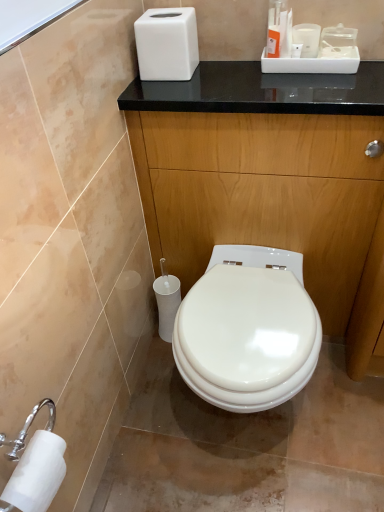
Describe the element at coordinates (37, 473) in the screenshot. I see `white matte toilet paper at lower left, which is the 1th toilet paper in front-to-back order` at that location.

I want to click on white matte toilet paper at lower left, marked as the 1th toilet paper in a bottom-to-top arrangement, so click(x=37, y=473).

Where is `white plastic toilet paper at lower left, which ranks as the second toilet paper in left-to-right order`? This screenshot has width=384, height=512. white plastic toilet paper at lower left, which ranks as the second toilet paper in left-to-right order is located at coordinates (167, 301).

At what (x,y) coordinates should I click in order to perform the action: click on white matte tissue box at upper center. Please return your answer as a coordinate pair (x, y). The image size is (384, 512). Looking at the image, I should click on (167, 44).

What's the angular difference between white plastic toilet paper at lower left, arranged as the 2th toilet paper when viewed from the front, and white matte tissue box at upper center's facing directions?

2.21 degrees separate the facing orientations of white plastic toilet paper at lower left, arranged as the 2th toilet paper when viewed from the front, and white matte tissue box at upper center.

Does white plastic toilet paper at lower left, which is counted as the 2th toilet paper, starting from the bottom, have a greater width compared to white matte tissue box at upper center?

Incorrect, the width of white plastic toilet paper at lower left, which is counted as the 2th toilet paper, starting from the bottom, does not surpass that of white matte tissue box at upper center.

Consider the image. Would you say white plastic toilet paper at lower left, which is counted as the 2th toilet paper, starting from the bottom, contains white matte tissue box at upper center?

No, white matte tissue box at upper center is located outside of white plastic toilet paper at lower left, which is counted as the 2th toilet paper, starting from the bottom.

From the image's perspective, is white plastic toilet paper at lower left, arranged as the 2th toilet paper when viewed from the front, over white matte tissue box at upper center?

No, from the image's perspective, white plastic toilet paper at lower left, arranged as the 2th toilet paper when viewed from the front, is not above white matte tissue box at upper center.

Based on the photo, is white matte toilet paper at lower left, which is the 1th toilet paper in front-to-back order, not within glossy wood dresser at center?

Yes, white matte toilet paper at lower left, which is the 1th toilet paper in front-to-back order, is not within glossy wood dresser at center.

Looking at their sizes, would you say white matte toilet paper at lower left, marked as the 1th toilet paper in a bottom-to-top arrangement, is wider or thinner than glossy wood dresser at center?

Considering their sizes, white matte toilet paper at lower left, marked as the 1th toilet paper in a bottom-to-top arrangement, looks slimmer than glossy wood dresser at center.

Is white matte toilet paper at lower left, marked as the 1th toilet paper in a bottom-to-top arrangement, next to glossy wood dresser at center and touching it?

No, white matte toilet paper at lower left, marked as the 1th toilet paper in a bottom-to-top arrangement, is not making contact with glossy wood dresser at center.

From the image's perspective, is white matte toilet paper at lower left, which is the 1th toilet paper in front-to-back order, located above glossy wood dresser at center?

No, from the image's perspective, white matte toilet paper at lower left, which is the 1th toilet paper in front-to-back order, is not over glossy wood dresser at center.

Where is `dresser lying above the white glossy toilet at center (from the image's perspective)`? dresser lying above the white glossy toilet at center (from the image's perspective) is located at coordinates (270, 181).

From a real-world perspective, is glossy wood dresser at center beneath white glossy toilet at center?

Incorrect, from a real-world perspective, glossy wood dresser at center is higher than white glossy toilet at center.

Is glossy wood dresser at center facing away from white glossy toilet at center?

Yes, glossy wood dresser at center is positioned with its back facing white glossy toilet at center.

Based on the photo, which of these two, glossy wood dresser at center or white glossy toilet at center, stands shorter?

white glossy toilet at center.

From a real-world perspective, is white matte tissue box at upper center physically located above or below white plastic toilet paper at lower left, which is counted as the 2th toilet paper, starting from the bottom?

white matte tissue box at upper center is situated higher than white plastic toilet paper at lower left, which is counted as the 2th toilet paper, starting from the bottom, in the real world.

Is white matte tissue box at upper center positioned with its back to white plastic toilet paper at lower left, marked as the 1th toilet paper in a top-to-bottom arrangement?

white matte tissue box at upper center does not have its back to white plastic toilet paper at lower left, marked as the 1th toilet paper in a top-to-bottom arrangement.

Could you measure the distance between white matte tissue box at upper center and white plastic toilet paper at lower left, which appears as the first toilet paper when viewed from the back?

A distance of 27.76 inches exists between white matte tissue box at upper center and white plastic toilet paper at lower left, which appears as the first toilet paper when viewed from the back.

Is white matte tissue box at upper center further to the viewer compared to white plastic toilet paper at lower left, arranged as the 2th toilet paper when viewed from the front?

No.

From the image's perspective, is glossy wood dresser at center beneath white matte tissue box at upper center?

Yes, from the image's perspective, glossy wood dresser at center is beneath white matte tissue box at upper center.

From a real-world perspective, between glossy wood dresser at center and white matte tissue box at upper center, who is vertically higher?

white matte tissue box at upper center.

Find the location of a particular element. The width and height of the screenshot is (384, 512). dresser below the white matte tissue box at upper center (from the image's perspective) is located at coordinates (270, 181).

Which is behind, point (251, 101) or point (168, 48)?

The point (251, 101) is behind.

Is white matte toilet paper at lower left, marked as the second toilet paper in a top-to-bottom arrangement, at the back of white matte tissue box at upper center?

No.

From the image's perspective, is white matte tissue box at upper center on white matte toilet paper at lower left, the 2th toilet paper viewed from the back?

Yes, from the image's perspective, white matte tissue box at upper center is on top of white matte toilet paper at lower left, the 2th toilet paper viewed from the back.

Does point (149, 11) lie behind point (2, 500)?

That is True.

Can you tell me how much white matte toilet paper at lower left, arranged as the first toilet paper when viewed from the left, and white glossy toilet at center differ in facing direction?

There is a 88.8-degree angle between the facing directions of white matte toilet paper at lower left, arranged as the first toilet paper when viewed from the left, and white glossy toilet at center.

Could you tell me if white matte toilet paper at lower left, which is the 1th toilet paper in front-to-back order, is turned towards white glossy toilet at center?

No, white matte toilet paper at lower left, which is the 1th toilet paper in front-to-back order, is not oriented towards white glossy toilet at center.

Which of these two, white matte toilet paper at lower left, the 2th toilet paper viewed from the back, or white glossy toilet at center, stands taller?

white glossy toilet at center.

The image size is (384, 512). I want to click on hand dryer located on the right of white plastic toilet paper at lower left, arranged as the 2th toilet paper when viewed from the front, so click(x=167, y=44).

There is a glossy wood dresser at center. Where is `the 2nd toilet paper below it (from the image's perspective)`? Image resolution: width=384 pixels, height=512 pixels. the 2nd toilet paper below it (from the image's perspective) is located at coordinates (37, 473).

Based on their spatial positions, is white matte toilet paper at lower left, marked as the 1th toilet paper in a bottom-to-top arrangement, or white glossy toilet at center further from white plastic toilet paper at lower left, arranged as the 2th toilet paper when viewed from the front?

Based on the image, white matte toilet paper at lower left, marked as the 1th toilet paper in a bottom-to-top arrangement, appears to be further to white plastic toilet paper at lower left, arranged as the 2th toilet paper when viewed from the front.

Estimate the real-world distances between objects in this image. Which object is closer to white glossy toilet at center, white matte tissue box at upper center or white matte toilet paper at lower left, marked as the 1th toilet paper in a bottom-to-top arrangement?

white matte toilet paper at lower left, marked as the 1th toilet paper in a bottom-to-top arrangement, lies closer to white glossy toilet at center than the other object.

Which object lies nearer to the anchor point white glossy toilet at center, white matte toilet paper at lower left, the 2th toilet paper viewed from the back, or white matte tissue box at upper center?

Result: white matte toilet paper at lower left, the 2th toilet paper viewed from the back, lies closer to white glossy toilet at center than the other object.

When comparing their distances from white matte tissue box at upper center, does glossy wood dresser at center or white plastic toilet paper at lower left, which ranks as the second toilet paper in left-to-right order, seem closer?

glossy wood dresser at center.

Estimate the real-world distances between objects in this image. Which object is further from white plastic toilet paper at lower left, which is counted as the 2th toilet paper, starting from the bottom, white glossy toilet at center or white matte tissue box at upper center?

white matte tissue box at upper center is further to white plastic toilet paper at lower left, which is counted as the 2th toilet paper, starting from the bottom.

Looking at this image, when comparing their distances from white plastic toilet paper at lower left, which is counted as the 2th toilet paper, starting from the bottom, does glossy wood dresser at center or white glossy toilet at center seem closer?

white glossy toilet at center is positioned closer to the anchor white plastic toilet paper at lower left, which is counted as the 2th toilet paper, starting from the bottom.

Considering their positions, is white glossy toilet at center positioned further to white matte tissue box at upper center than white matte toilet paper at lower left, arranged as the first toilet paper when viewed from the left?

Based on the image, white matte toilet paper at lower left, arranged as the first toilet paper when viewed from the left, appears to be further to white matte tissue box at upper center.

When comparing their distances from white glossy toilet at center, does glossy wood dresser at center or white plastic toilet paper at lower left, arranged as the 2th toilet paper when viewed from the front, seem further?

white plastic toilet paper at lower left, arranged as the 2th toilet paper when viewed from the front, is positioned further to the anchor white glossy toilet at center.

Where is `dresser positioned between white matte toilet paper at lower left, acting as the second toilet paper starting from the right, and white plastic toilet paper at lower left, the 1th toilet paper positioned from the right, from near to far`? The width and height of the screenshot is (384, 512). dresser positioned between white matte toilet paper at lower left, acting as the second toilet paper starting from the right, and white plastic toilet paper at lower left, the 1th toilet paper positioned from the right, from near to far is located at coordinates (270, 181).

Locate an element on the screen. Image resolution: width=384 pixels, height=512 pixels. toilet between white matte toilet paper at lower left, marked as the second toilet paper in a top-to-bottom arrangement, and white plastic toilet paper at lower left, which is counted as the 2th toilet paper, starting from the bottom, in the front-back direction is located at coordinates (248, 330).

I want to click on toilet between glossy wood dresser at center and white matte toilet paper at lower left, the 2th toilet paper viewed from the back, in the vertical direction, so click(248, 330).

What are the coordinates of `dresser that lies between white matte tissue box at upper center and white glossy toilet at center from top to bottom` in the screenshot? It's located at (270, 181).